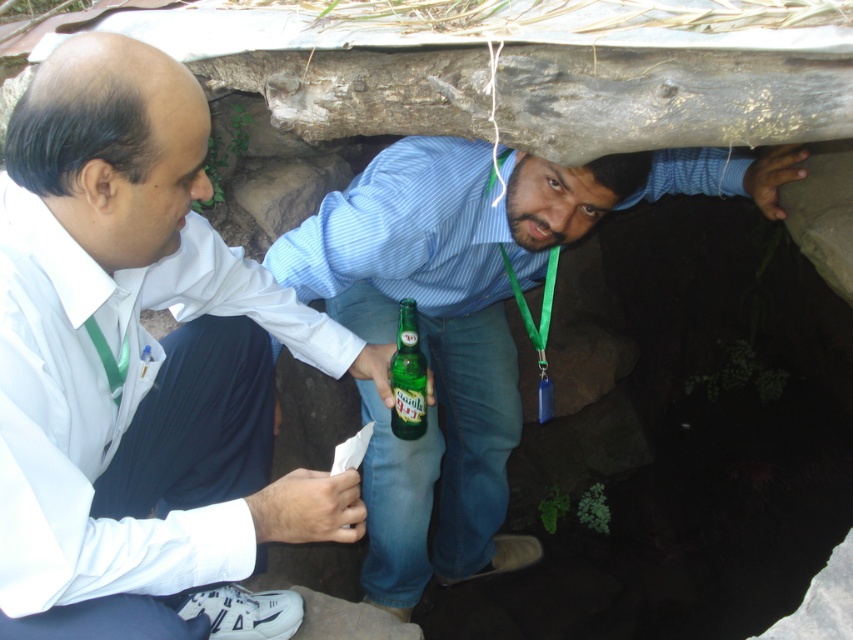
Question: Which is nearer to the white shirt at center?

Choices:
 (A) green glass bottle at center
 (B) matte green glass bottle at center

Answer: (A)

Question: Observing the image, what is the correct spatial positioning of white shirt at center in reference to green glass bottle at center?

Choices:
 (A) right
 (B) left

Answer: (B)

Question: Estimate the real-world distances between objects in this image. Which object is farther from the matte green glass bottle at center?

Choices:
 (A) green glass bottle at center
 (B) white shirt at center

Answer: (B)

Question: Which point appears farthest from the camera in this image?

Choices:
 (A) coord(541,273)
 (B) coord(410,403)
 (C) coord(45,572)

Answer: (A)

Question: In this image, where is white shirt at center located relative to matte green glass bottle at center?

Choices:
 (A) right
 (B) left

Answer: (B)

Question: Is white shirt at center to the left of green glass bottle at center from the viewer's perspective?

Choices:
 (A) no
 (B) yes

Answer: (B)